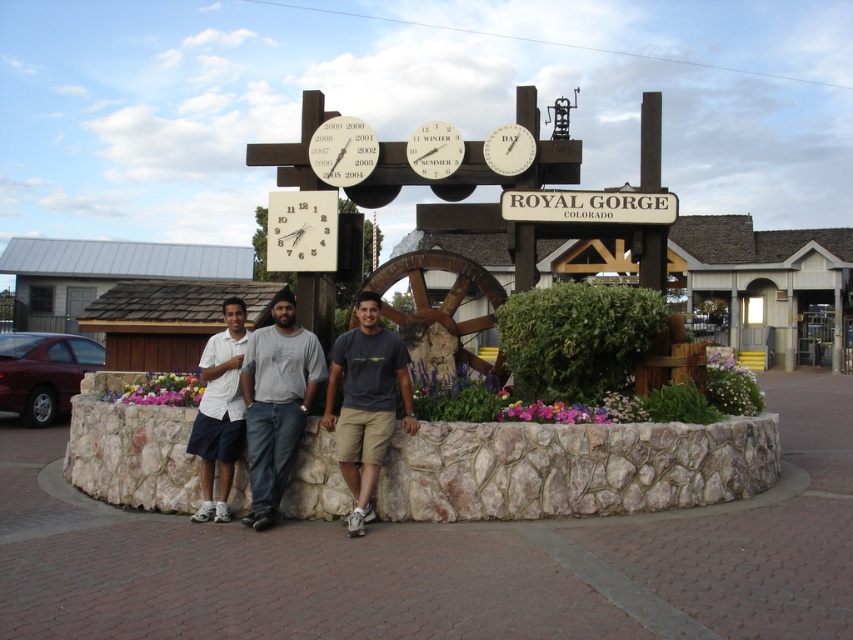
Is point (366, 365) more distant than point (227, 349)?

That is False.

Where is `dark gray t-shirt at center`? Image resolution: width=853 pixels, height=640 pixels. dark gray t-shirt at center is located at coordinates [x=366, y=403].

What do you see at coordinates (302, 230) in the screenshot? Image resolution: width=853 pixels, height=640 pixels. I see `white plastic clock at center` at bounding box center [302, 230].

Is the position of white plastic clock at center less distant than that of white wooden sign at center?

No, it is not.

Image resolution: width=853 pixels, height=640 pixels. What are the coordinates of `white plastic clock at center` in the screenshot? It's located at (302, 230).

This screenshot has height=640, width=853. I want to click on white plastic clock at center, so [x=302, y=230].

Who is lower down, denim jeans at center or white wooden sign at center?

denim jeans at center is lower down.

How distant is denim jeans at center from white wooden sign at center?

denim jeans at center and white wooden sign at center are 3.51 meters apart.

Which is behind, point (254, 413) or point (631, 202)?

The point (631, 202) is more distant.

Image resolution: width=853 pixels, height=640 pixels. Find the location of `denim jeans at center`. denim jeans at center is located at coordinates tap(276, 403).